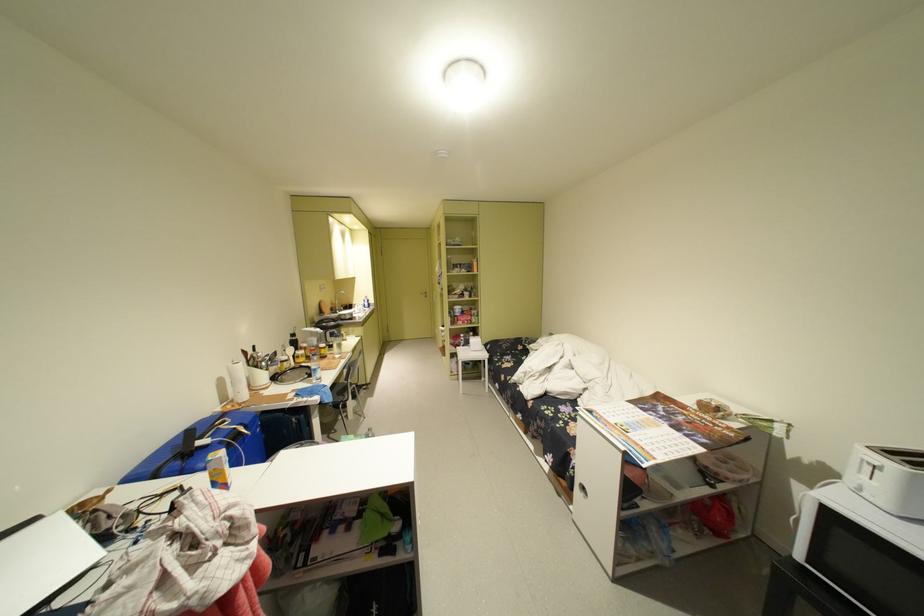
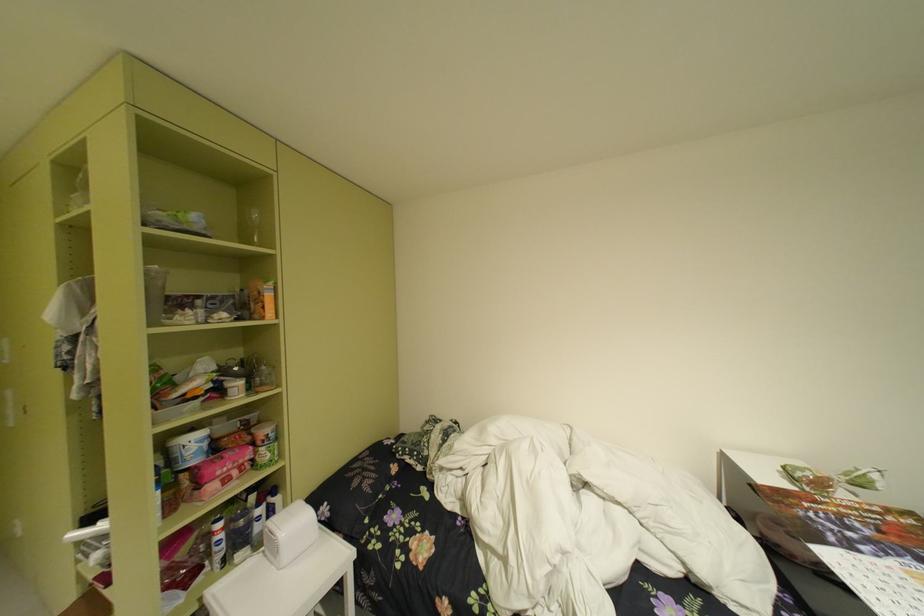
Where in the second image is the point corresponding to point (473, 338) from the first image?

(235, 528)